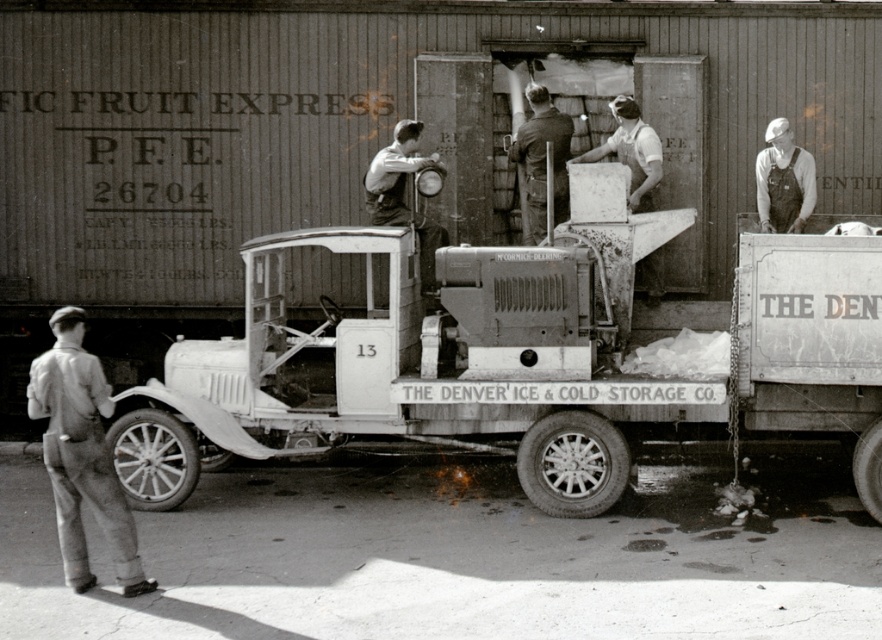
From the picture: You are standing in front of the vintage scene. You see the metallic white trailer truck at center and the dark brown leather jacket at upper center. Which object is positioned to the left?

The metallic white trailer truck at center is to the left of the dark brown leather jacket at upper center.

You are a delivery driver who needs to park your truck in a space that is 10 feet long. Given the distance between the metallic white trailer truck at center and the dark brown leather jacket at upper center, can your truck fit in the parking space?

The distance between the metallic white trailer truck at center and the dark brown leather jacket at upper center is 6.32 feet. Since the parking space is 10 feet long, your truck can fit comfortably within the space as 6.32 feet is less than 10 feet.

You are an observer looking at the vintage photograph. You notice the matte black overalls at center. Based on their position in the image, can you determine if they are closer to the top or bottom of the frame?

The matte black overalls at center is located at point (x=402, y=193), which places them closer to the bottom of the frame since the y coordinate is 0.458, meaning it is below the midpoint of the image vertically.